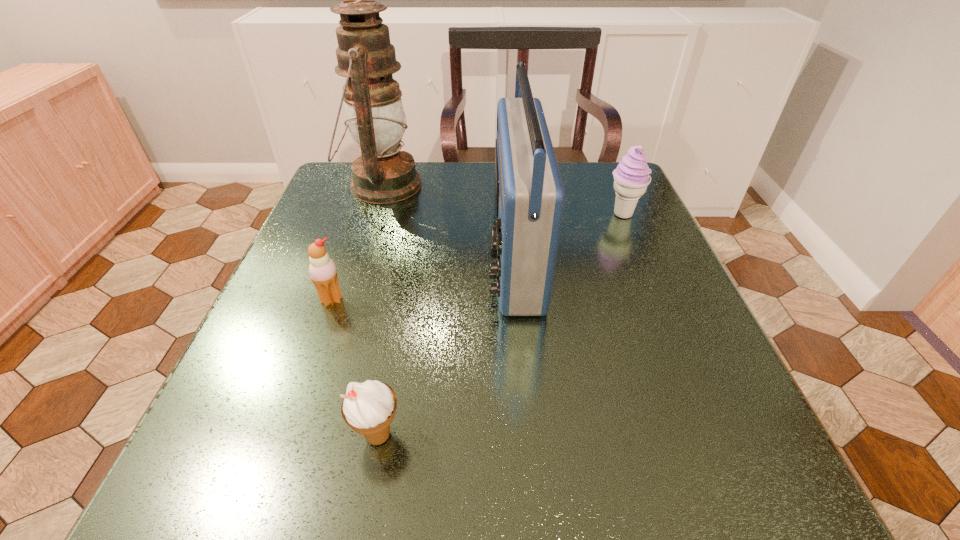
Where is `free space located on the front panel of the radio receiver`? Image resolution: width=960 pixels, height=540 pixels. free space located on the front panel of the radio receiver is located at coordinates (433, 254).

Identify the location of free space located 0.280m on the front panel of the radio receiver. This screenshot has width=960, height=540. (348, 254).

Identify the location of vacant area situated 0.250m on the left of the tallest icecream. (493, 214).

Image resolution: width=960 pixels, height=540 pixels. Find the location of `free space located 0.110m at the front with a straw on the leftmost icecream`. free space located 0.110m at the front with a straw on the leftmost icecream is located at coordinates (311, 360).

Image resolution: width=960 pixels, height=540 pixels. What are the coordinates of `free space located on the back of the second icecream from right to left` in the screenshot? It's located at (405, 290).

The height and width of the screenshot is (540, 960). I want to click on lantern that is at the far edge, so click(x=383, y=174).

Where is `radio receiver situated at the far edge`? The width and height of the screenshot is (960, 540). radio receiver situated at the far edge is located at coordinates (529, 196).

Find the location of `icecream that is at the far edge`. icecream that is at the far edge is located at coordinates (631, 177).

Where is `object located in the near edge section of the desktop`? object located in the near edge section of the desktop is located at coordinates (368, 408).

Locate an element on the screen. The height and width of the screenshot is (540, 960). lantern present at the left edge is located at coordinates (383, 174).